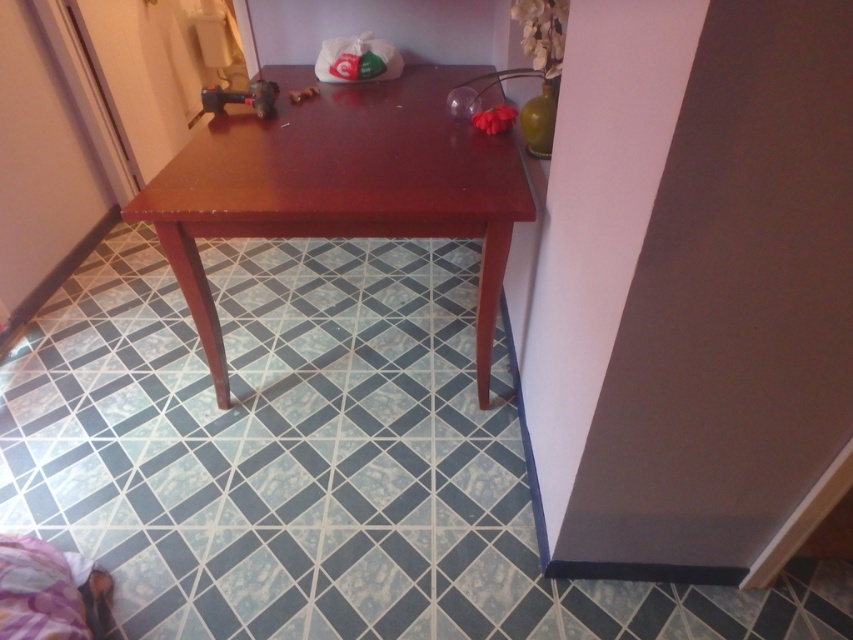
Question: Which point is closer to the camera?

Choices:
 (A) metallic silver hammer at center
 (B) transparent glass lamp at upper center
 (C) patterned tile at center

Answer: (C)

Question: Does patterned tile at center appear on the right side of metallic plastic toy at center?

Choices:
 (A) yes
 (B) no

Answer: (A)

Question: Which of the following is the closest to the observer?

Choices:
 (A) (277, 77)
 (B) (294, 97)

Answer: (B)

Question: Does patterned tile at center lie in front of matte wood table at center?

Choices:
 (A) yes
 (B) no

Answer: (A)

Question: Which of the following is the closest to the observer?

Choices:
 (A) metallic plastic toy at center
 (B) metallic silver hammer at center
 (C) matte wood table at center
 (D) transparent glass lamp at upper center

Answer: (C)

Question: Does transparent glass lamp at upper center lie in front of metallic silver hammer at center?

Choices:
 (A) yes
 (B) no

Answer: (A)